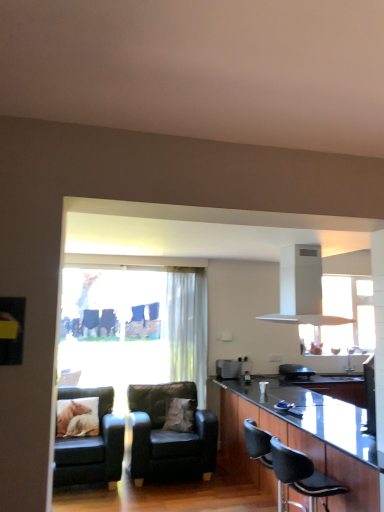
Question: Is white soft pillow at center, the 1th pillow in the right-to-left sequence, further to the viewer compared to translucent fabric curtain at center?

Choices:
 (A) yes
 (B) no

Answer: (B)

Question: Is white soft pillow at center, marked as the 2th pillow in a left-to-right arrangement, beside translucent fabric curtain at center?

Choices:
 (A) yes
 (B) no

Answer: (B)

Question: Is white soft pillow at center, the 1th pillow in the right-to-left sequence, looking in the opposite direction of translucent fabric curtain at center?

Choices:
 (A) no
 (B) yes

Answer: (A)

Question: Considering the relative sizes of white soft pillow at center, the 1th pillow in the right-to-left sequence, and translucent fabric curtain at center in the image provided, is white soft pillow at center, the 1th pillow in the right-to-left sequence, shorter than translucent fabric curtain at center?

Choices:
 (A) yes
 (B) no

Answer: (A)

Question: Is white soft pillow at center, the 1th pillow in the right-to-left sequence, positioned beyond the bounds of translucent fabric curtain at center?

Choices:
 (A) no
 (B) yes

Answer: (B)

Question: Based on their sizes in the image, would you say black glossy countertop at center is bigger or smaller than black leather chair at lower right, which is counted as the 1th chair, starting from the right?

Choices:
 (A) small
 (B) big

Answer: (B)

Question: Is point (288, 395) positioned closer to the camera than point (276, 467)?

Choices:
 (A) closer
 (B) farther

Answer: (B)

Question: From a real-world perspective, is black glossy countertop at center physically located above or below black leather chair at lower right, which is counted as the 1th chair, starting from the front?

Choices:
 (A) above
 (B) below

Answer: (B)

Question: Do you think black glossy countertop at center is within black leather chair at lower right, the 3th chair from the left, or outside of it?

Choices:
 (A) outside
 (B) inside

Answer: (A)

Question: From the image's perspective, is black leather armchair at lower center above or below translucent fabric curtain at center?

Choices:
 (A) above
 (B) below

Answer: (B)

Question: Considering the positions of black leather armchair at lower center and translucent fabric curtain at center in the image, is black leather armchair at lower center taller or shorter than translucent fabric curtain at center?

Choices:
 (A) short
 (B) tall

Answer: (A)

Question: Looking at the image, does black leather armchair at lower center seem bigger or smaller compared to translucent fabric curtain at center?

Choices:
 (A) big
 (B) small

Answer: (B)

Question: Is black leather armchair at lower center in front of or behind translucent fabric curtain at center in the image?

Choices:
 (A) behind
 (B) front

Answer: (B)

Question: In the image, is black glossy countertop at center on the left side or the right side of white matte exhaust hood at upper center?

Choices:
 (A) right
 (B) left

Answer: (A)

Question: Is black glossy countertop at center inside the boundaries of white matte exhaust hood at upper center, or outside?

Choices:
 (A) outside
 (B) inside

Answer: (A)